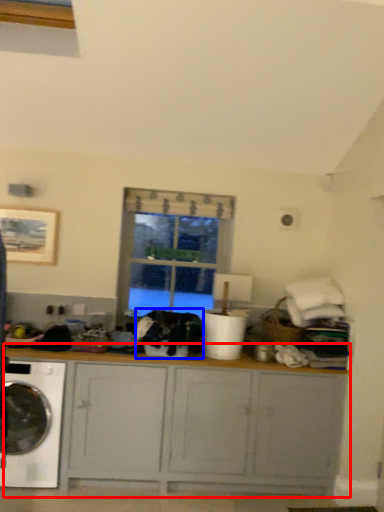
Question: Which point is closer to the camera, cabinetry (highlighted by a red box) or clothing (highlighted by a blue box)?

Choices:
 (A) cabinetry
 (B) clothing

Answer: (A)